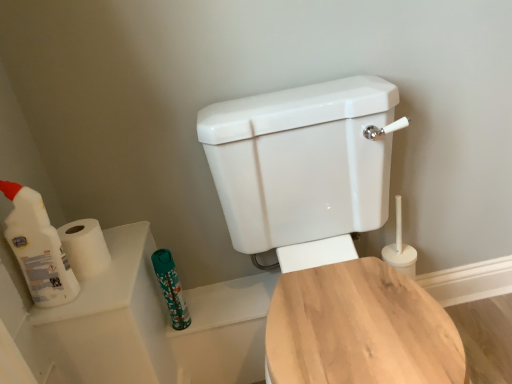
This screenshot has height=384, width=512. In order to click on free spot to the right of white matte toilet paper at left in this screenshot , I will do `click(129, 260)`.